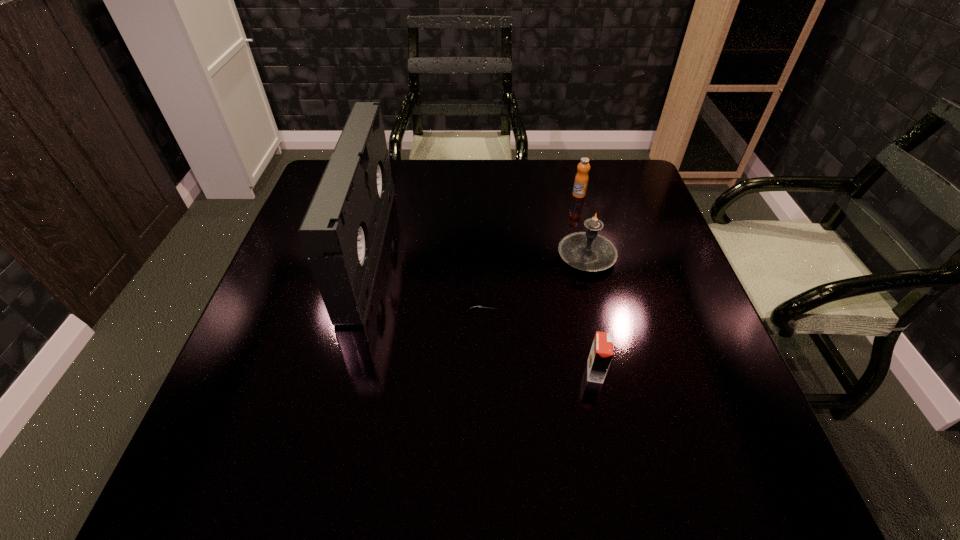
Locate an element on the screen. This screenshot has height=540, width=960. videotape is located at coordinates (342, 232).

What are the coordinates of `the tallest object` in the screenshot? It's located at pos(342,232).

Where is `candle`? candle is located at coordinates (588, 251).

Locate an element on the screen. the taller orange juice is located at coordinates (581, 180).

Locate an element on the screen. the farther orange juice is located at coordinates pyautogui.click(x=581, y=180).

In order to click on the shorter orange juice in this screenshot , I will do `click(601, 353)`.

This screenshot has width=960, height=540. I want to click on the fourth tallest object, so click(x=601, y=353).

This screenshot has width=960, height=540. In order to click on the shortest object in this screenshot , I will do `click(473, 303)`.

Where is `shears`? Image resolution: width=960 pixels, height=540 pixels. shears is located at coordinates (473, 303).

Find the location of a particular element. The height and width of the screenshot is (540, 960). vacant space positioned 0.150m on the side of the videotape with visible spindles is located at coordinates (441, 249).